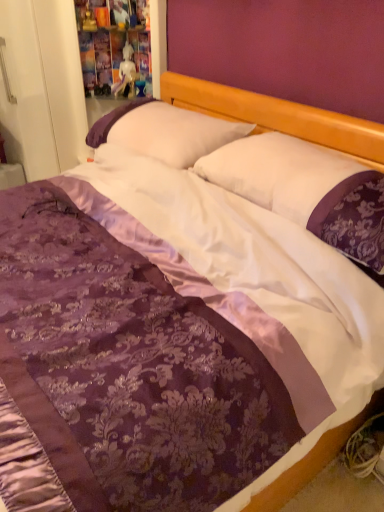
Question: Is the position of white glossy statue at upper center less distant than that of white satin pillow at center, the 1th pillow positioned from the front?

Choices:
 (A) no
 (B) yes

Answer: (A)

Question: Does white glossy statue at upper center have a greater height compared to white satin pillow at center, the 1th pillow positioned from the front?

Choices:
 (A) yes
 (B) no

Answer: (A)

Question: Does white glossy statue at upper center appear on the right side of white satin pillow at center, the 1th pillow positioned from the front?

Choices:
 (A) yes
 (B) no

Answer: (B)

Question: Can you confirm if white glossy statue at upper center is wider than white satin pillow at center, the 1th pillow positioned from the front?

Choices:
 (A) yes
 (B) no

Answer: (B)

Question: From a real-world perspective, is white glossy statue at upper center below white satin pillow at center, the 1th pillow positioned from the front?

Choices:
 (A) yes
 (B) no

Answer: (B)

Question: Looking at the image, does white satin pillow at center, which appears as the first pillow when viewed from the back, seem bigger or smaller compared to white satin pillow at center, the second pillow viewed from the back?

Choices:
 (A) small
 (B) big

Answer: (B)

Question: Would you say white satin pillow at center, the second pillow viewed from the front, is inside or outside white satin pillow at center, the 1th pillow positioned from the front?

Choices:
 (A) outside
 (B) inside

Answer: (A)

Question: Is white satin pillow at center, the second pillow viewed from the front, to the left or to the right of white satin pillow at center, the 1th pillow positioned from the front, in the image?

Choices:
 (A) right
 (B) left

Answer: (B)

Question: From the image's perspective, is white satin pillow at center, which appears as the first pillow when viewed from the back, above or below white satin pillow at center, the 1th pillow positioned from the front?

Choices:
 (A) above
 (B) below

Answer: (A)

Question: Based on their sizes in the image, would you say white satin pillow at center, the 1th pillow positioned from the front, is bigger or smaller than white satin pillow at center, which appears as the first pillow when viewed from the back?

Choices:
 (A) small
 (B) big

Answer: (A)

Question: Choose the correct answer: Is white satin pillow at center, the 1th pillow positioned from the front, inside white satin pillow at center, which appears as the first pillow when viewed from the back, or outside it?

Choices:
 (A) inside
 (B) outside

Answer: (B)

Question: Is white satin pillow at center, the 1th pillow positioned from the front, taller or shorter than white satin pillow at center, which appears as the first pillow when viewed from the back?

Choices:
 (A) short
 (B) tall

Answer: (A)

Question: From a real-world perspective, is white satin pillow at center, the 1th pillow positioned from the front, above or below white satin pillow at center, the second pillow viewed from the front?

Choices:
 (A) below
 (B) above

Answer: (B)

Question: In the image, is white glossy statue at upper center on the left side or the right side of white satin pillow at center, the second pillow viewed from the front?

Choices:
 (A) right
 (B) left

Answer: (B)

Question: In terms of size, does white glossy statue at upper center appear bigger or smaller than white satin pillow at center, which appears as the first pillow when viewed from the back?

Choices:
 (A) big
 (B) small

Answer: (B)